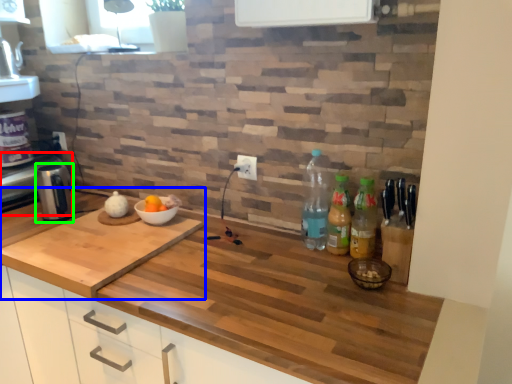
Question: Estimate the real-world distances between objects in this image. Which object is closer to appliance (highlighted by a red box), countertop (highlighted by a blue box) or coffee machine (highlighted by a green box)?

Choices:
 (A) countertop
 (B) coffee machine

Answer: (B)